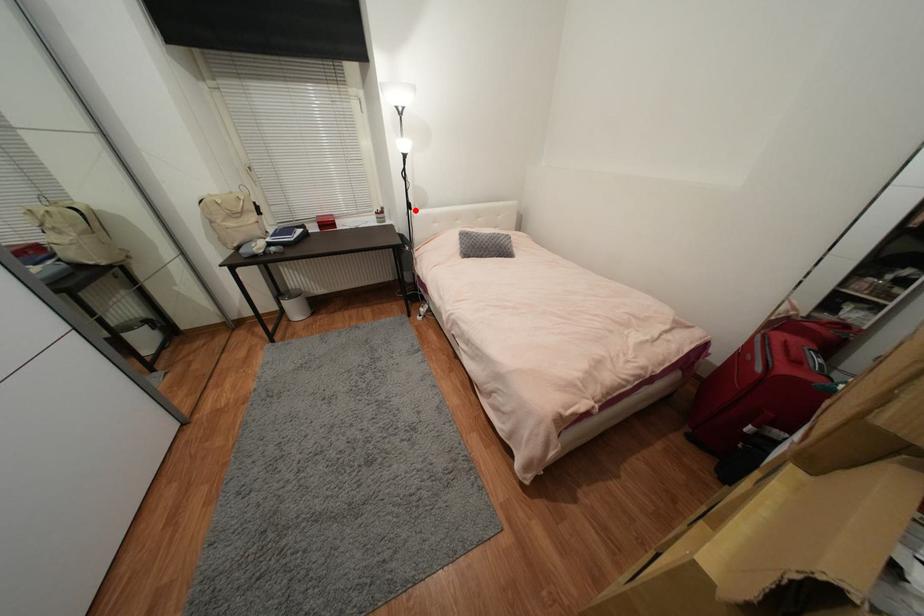
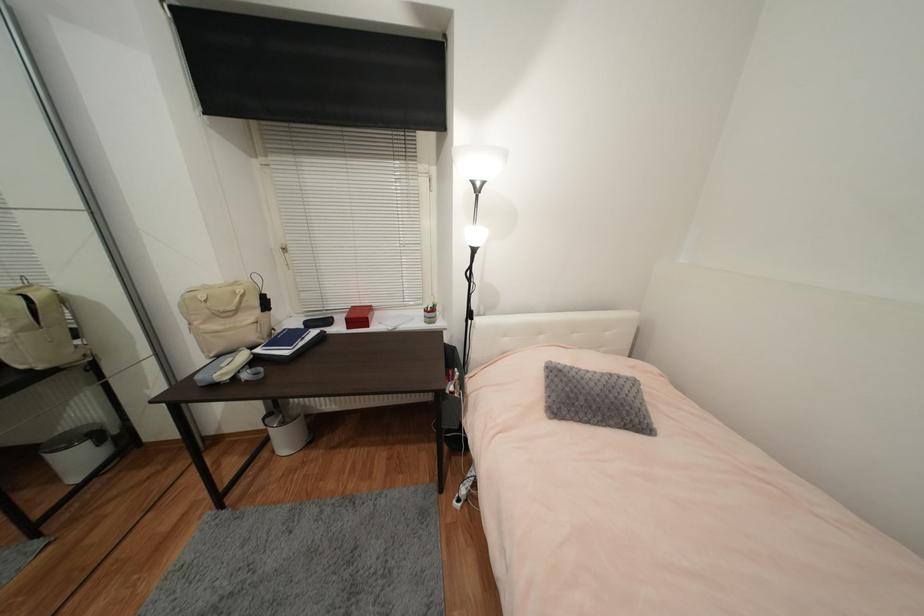
Question: I am providing you with two images of the same scene from different viewpoints. A red point is shown in image1. For the corresponding object point in image2, is it positioned nearer or farther from the camera?

Choices:
 (A) Nearer
 (B) Farther

Answer: (B)